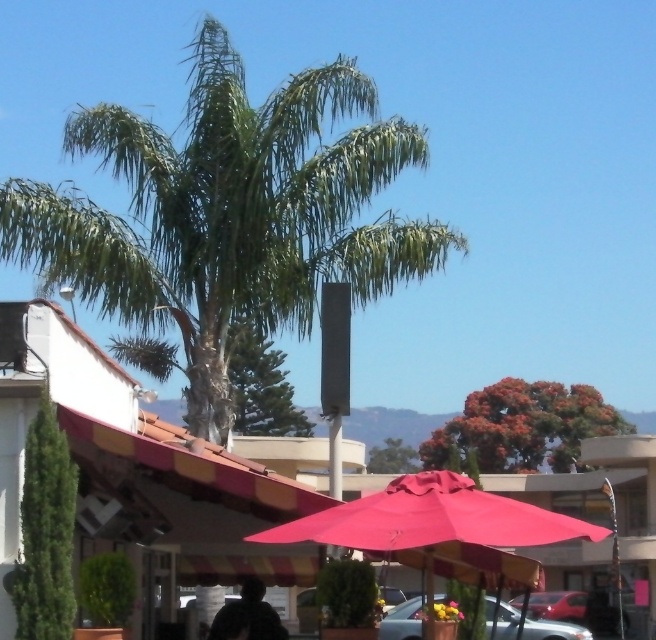
You are a painter setting up an easel to paint the scene. You want to ensure both the green leafy palm tree at center and the striped awning at center are fully visible in your painting. Based on their widths, which object should you position closer to the center of your canvas to avoid cropping?

The green leafy palm tree at center is wider than the striped awning at center, so positioning the palm tree closer to the center of the canvas will ensure it fits without cropping while the awning can be placed slightly off center.

You are standing at the base of the green leafy palm tree at center and want to reach the dark fabric silhouette at lower center. Given that the distance between them is 38.47 meters, how many steps would you need to take if each step covers approximately 0.76 meters?

To determine the number of steps required to cover 38.47 meters with each step being 0.76 meters, divide the total distance by the step length. 38.47 divided by 0.76 equals approximately 50.62 steps. Since you can only take whole steps, you would need about 51 steps to reach the dark fabric silhouette at lower center from the green leafy palm tree at center.

You are a delivery driver who needs to park your metallic silver car at lower center without damaging the green leafy palm tree at center. Based on their positions, can you safely park the car without hitting the tree?

The green leafy palm tree at center is above the metallic silver car at lower center, so the tree is positioned higher up in the scene. Since the car is at lower center, it is likely parked below the tree and not in a direct path where collision would occur during parking. Therefore, you can safely park the metallic silver car at lower center without hitting the green leafy palm tree at center.